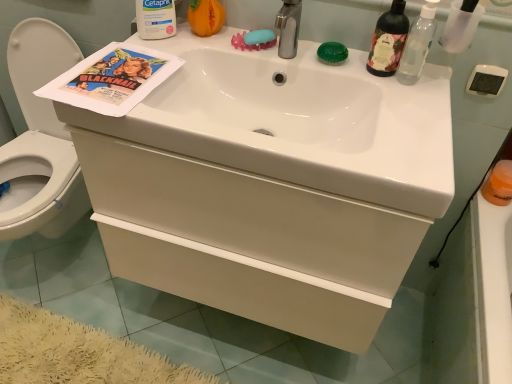
Identify the location of free space between blue rubber soap at upper center, the 1th soap positioned from the left, and white matte lotion at upper center, which is counted as the 3th bottle, starting from the right. Image resolution: width=512 pixels, height=384 pixels. (196, 41).